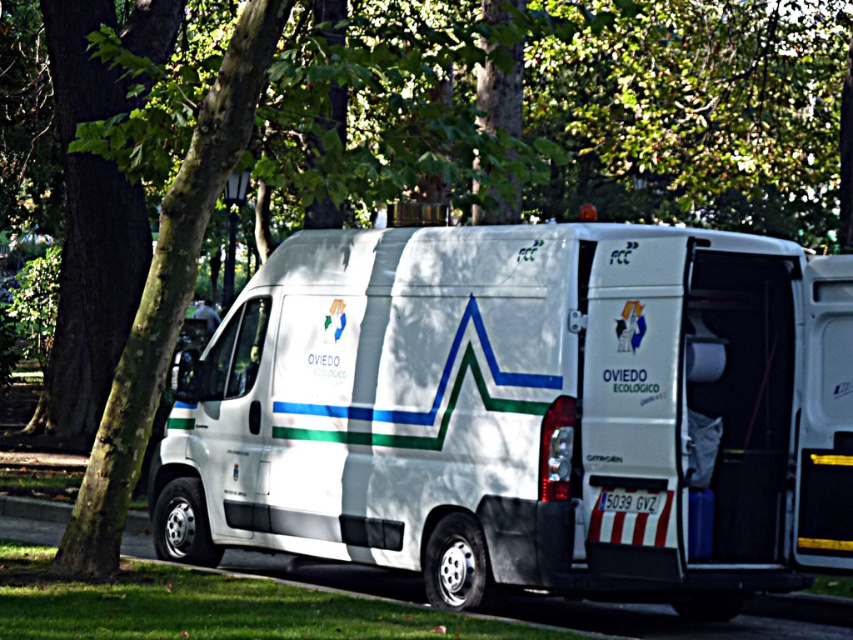
Does white matte van at center have a lesser height compared to green leafy tree at upper left?

Indeed, white matte van at center has a lesser height compared to green leafy tree at upper left.

Is white matte van at center to the left of green leafy tree at upper left from the viewer's perspective?

Indeed, white matte van at center is positioned on the left side of green leafy tree at upper left.

The image size is (853, 640). Describe the element at coordinates (525, 413) in the screenshot. I see `white matte van at center` at that location.

I want to click on white matte van at center, so click(x=525, y=413).